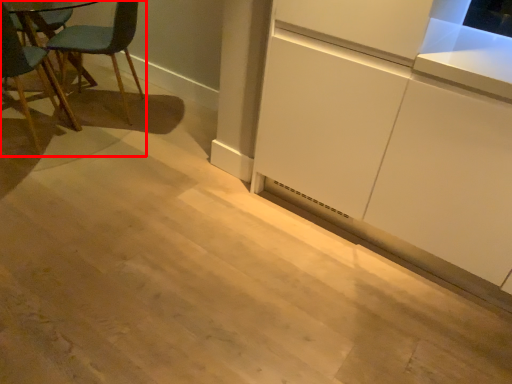
Question: From the image's perspective, what is the correct spatial relationship of chair (annotated by the red box) in relation to cabinetry?

Choices:
 (A) above
 (B) below

Answer: (A)